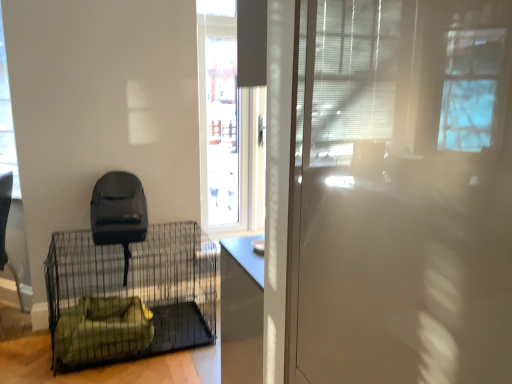
What do you see at coordinates (7, 121) in the screenshot? I see `transparent glass window at upper left` at bounding box center [7, 121].

You are a GUI agent. You are given a task and a screenshot of the screen. Output one action in this format:
    pyautogui.click(x=<x>, y=<y>)
    Task: Click on the transparent glass window at upper left
    The height and width of the screenshot is (384, 512).
    Given the screenshot: What is the action you would take?
    pyautogui.click(x=7, y=121)

The height and width of the screenshot is (384, 512). Describe the element at coordinates (130, 296) in the screenshot. I see `green fabric pet bed at lower left` at that location.

I want to click on green fabric pet bed at lower left, so click(x=130, y=296).

Where is `transparent glass window at upper left`? transparent glass window at upper left is located at coordinates [x=7, y=121].

Is transparent glass window at upper left to the right of green fabric pet bed at lower left from the viewer's perspective?

No.

Which is in front, transparent glass window at upper left or green fabric pet bed at lower left?

green fabric pet bed at lower left.

Which is closer to the camera, (3,171) or (101,348)?

Point (3,171) is farther from the camera than point (101,348).

From the image's perspective, which is below, transparent glass window at upper left or green fabric pet bed at lower left?

green fabric pet bed at lower left appears lower in the image.

From a real-world perspective, which is physically above, transparent glass window at upper left or green fabric pet bed at lower left?

transparent glass window at upper left is physically above.

Can you confirm if transparent glass window at upper left is thinner than green fabric pet bed at lower left?

Yes.

Between transparent glass window at upper left and green fabric pet bed at lower left, which one has more height?

With more height is transparent glass window at upper left.

Looking at this image, who is smaller, transparent glass window at upper left or green fabric pet bed at lower left?

transparent glass window at upper left.

Is transparent glass window at upper left positioned beyond the bounds of green fabric pet bed at lower left?

Yes.

Would you say transparent glass window at upper left is a long distance from green fabric pet bed at lower left?

No.

Is transparent glass window at upper left oriented away from green fabric pet bed at lower left?

transparent glass window at upper left does not have its back to green fabric pet bed at lower left.

Where is `window above the green fabric pet bed at lower left (from the image's perspective)`? This screenshot has width=512, height=384. window above the green fabric pet bed at lower left (from the image's perspective) is located at coordinates (7, 121).

Consider the image. Can you confirm if green fabric pet bed at lower left is positioned to the right of transparent glass window at upper left?

Correct, you'll find green fabric pet bed at lower left to the right of transparent glass window at upper left.

Which is in front, green fabric pet bed at lower left or transparent glass window at upper left?

green fabric pet bed at lower left is in front.

Considering the points (184, 238) and (7, 78), which point is behind, point (184, 238) or point (7, 78)?

The point (184, 238) is farther from the camera.

Consider the image. From the image's perspective, is green fabric pet bed at lower left on top of transparent glass window at upper left?

Actually, green fabric pet bed at lower left appears below transparent glass window at upper left in the image.

From a real-world perspective, is green fabric pet bed at lower left physically below transparent glass window at upper left?

Yes, from a real-world perspective, green fabric pet bed at lower left is below transparent glass window at upper left.

Looking at their sizes, would you say green fabric pet bed at lower left is wider or thinner than transparent glass window at upper left?

Clearly, green fabric pet bed at lower left has more width compared to transparent glass window at upper left.

Considering the sizes of objects green fabric pet bed at lower left and transparent glass window at upper left in the image provided, who is taller, green fabric pet bed at lower left or transparent glass window at upper left?

With more height is transparent glass window at upper left.

Is green fabric pet bed at lower left smaller than transparent glass window at upper left?

Incorrect, green fabric pet bed at lower left is not smaller in size than transparent glass window at upper left.

Which is correct: green fabric pet bed at lower left is inside transparent glass window at upper left, or outside of it?

The correct answer is: outside.

Is green fabric pet bed at lower left directly adjacent to transparent glass window at upper left?

There is a gap between green fabric pet bed at lower left and transparent glass window at upper left.

Does green fabric pet bed at lower left turn towards transparent glass window at upper left?

No, green fabric pet bed at lower left does not turn towards transparent glass window at upper left.

What's the angular difference between green fabric pet bed at lower left and transparent glass window at upper left's facing directions?

The angular difference between green fabric pet bed at lower left and transparent glass window at upper left is 46.8 degrees.

Where is `furniture directly beneath the transparent glass window at upper left (from a real-world perspective)`? The image size is (512, 384). furniture directly beneath the transparent glass window at upper left (from a real-world perspective) is located at coordinates (130, 296).

Locate an element on the screen. The image size is (512, 384). furniture that appears below the transparent glass window at upper left (from the image's perspective) is located at coordinates (130, 296).

This screenshot has width=512, height=384. In order to click on window above the green fabric pet bed at lower left (from the image's perspective) in this screenshot , I will do (x=7, y=121).